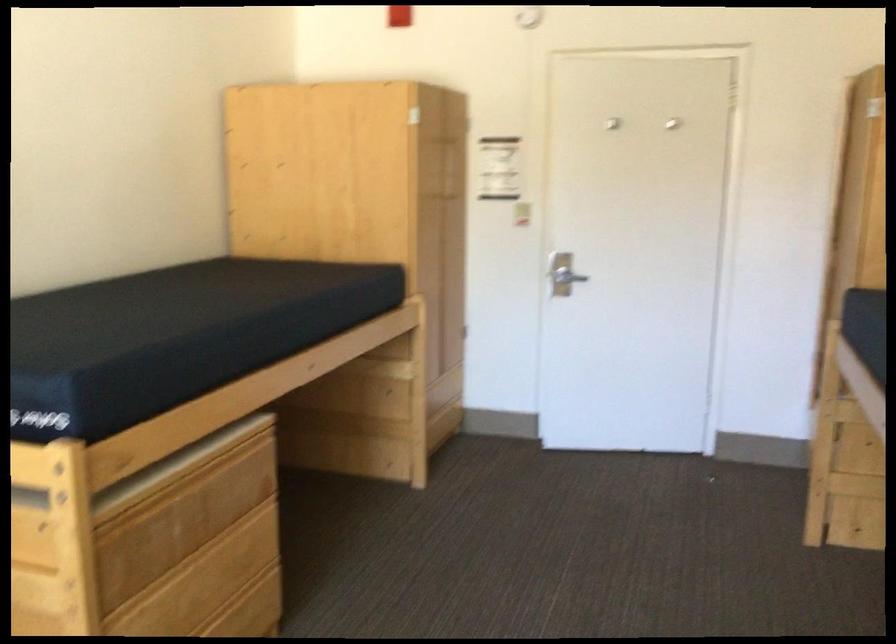
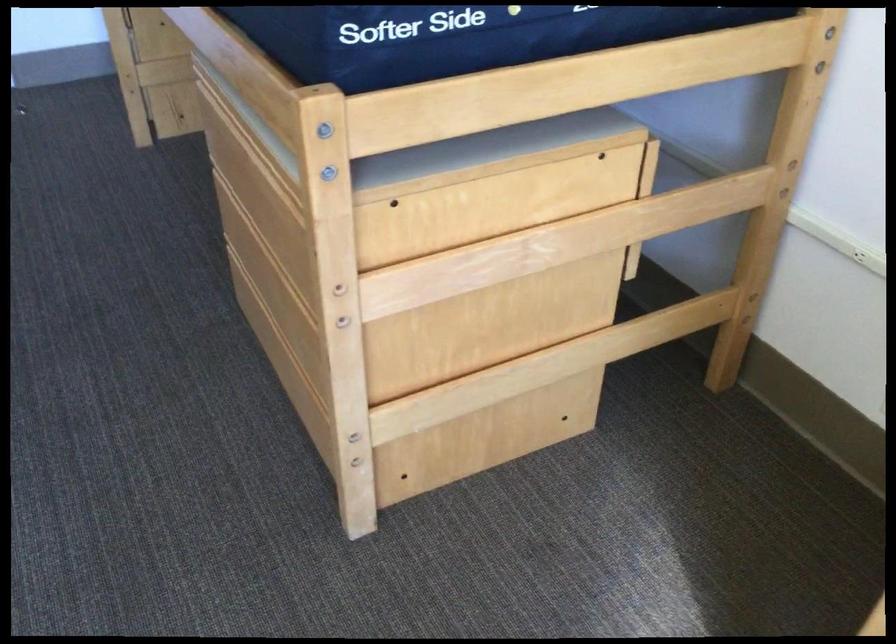
From the picture: The images are taken continuously from a first-person perspective. In which direction is your viewpoint rotating?

The camera's rotation is toward right-down.